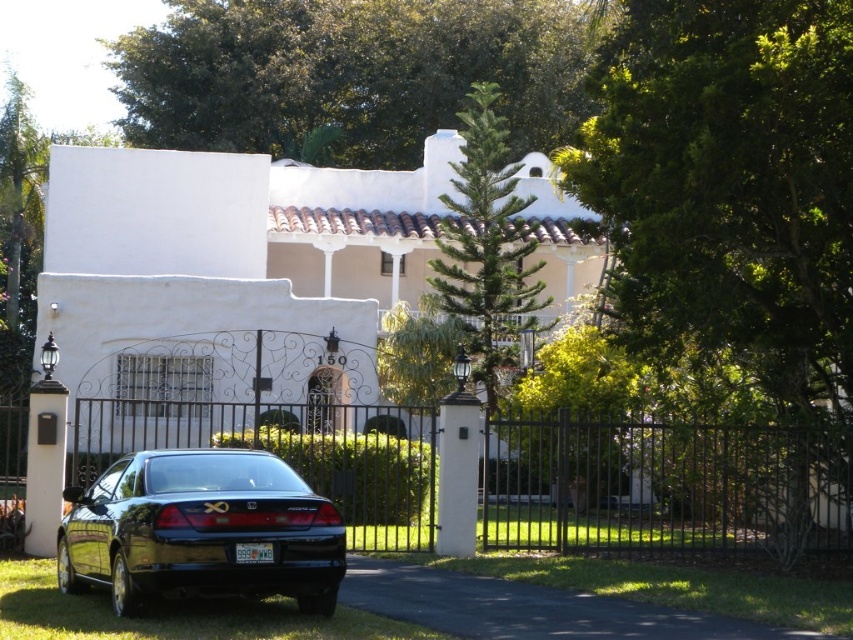
Can you confirm if white stucco villa at center is positioned below black asphalt driveway at center?

No.

This screenshot has width=853, height=640. Describe the element at coordinates (229, 268) in the screenshot. I see `white stucco villa at center` at that location.

Who is more forward, (135, 378) or (532, 605)?

Point (532, 605) is in front.

Find the location of a particular element. The height and width of the screenshot is (640, 853). white stucco villa at center is located at coordinates (229, 268).

Does white stucco villa at center have a smaller size compared to black metal fence at center?

Actually, white stucco villa at center might be larger than black metal fence at center.

Does white stucco villa at center come behind black metal fence at center?

That is True.

This screenshot has width=853, height=640. I want to click on white stucco villa at center, so click(229, 268).

In the scene shown: Does black metal fence at center appear under black asphalt driveway at center?

Actually, black metal fence at center is above black asphalt driveway at center.

Does black metal fence at center have a smaller size compared to black asphalt driveway at center?

Actually, black metal fence at center might be larger than black asphalt driveway at center.

Is point (360, 506) in front of point (560, 621)?

No.

At what (x,y) coordinates should I click in order to perform the action: click on black metal fence at center. Please return your answer as a coordinate pair (x, y). The width and height of the screenshot is (853, 640). Looking at the image, I should click on (662, 484).